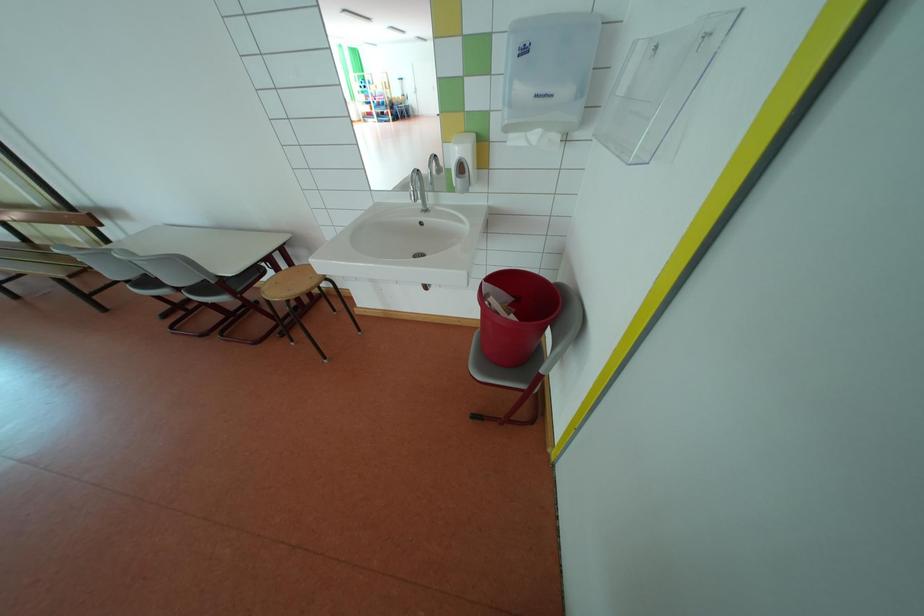
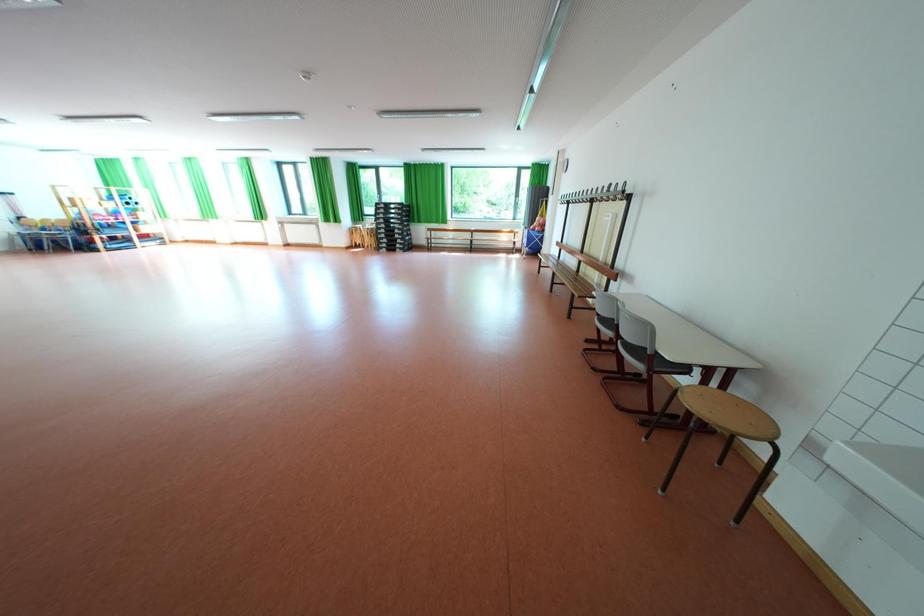
Question: The first image is from the beginning of the video and the second image is from the end. How did the camera likely rotate when shooting the video?

Choices:
 (A) Left
 (B) Right
 (C) Up
 (D) Down

Answer: (A)